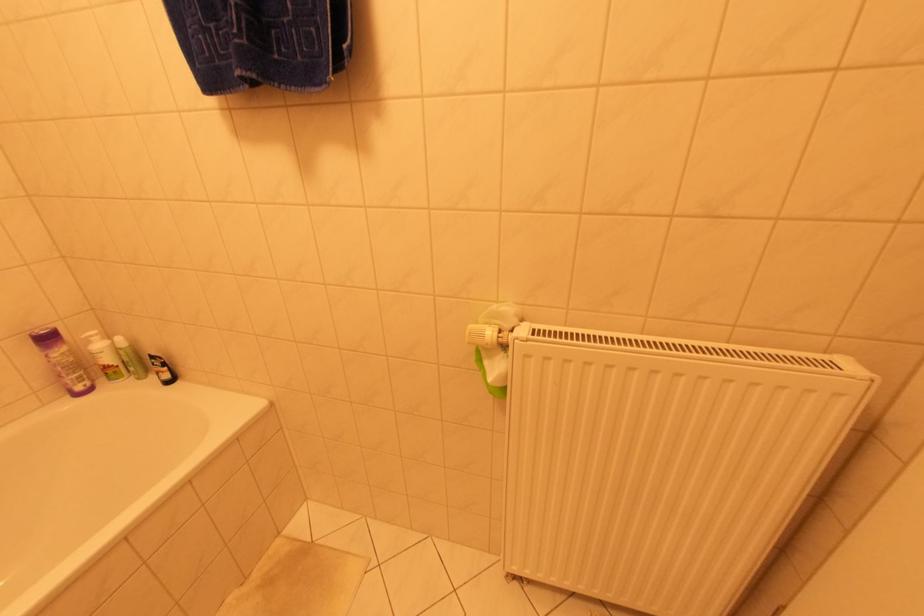
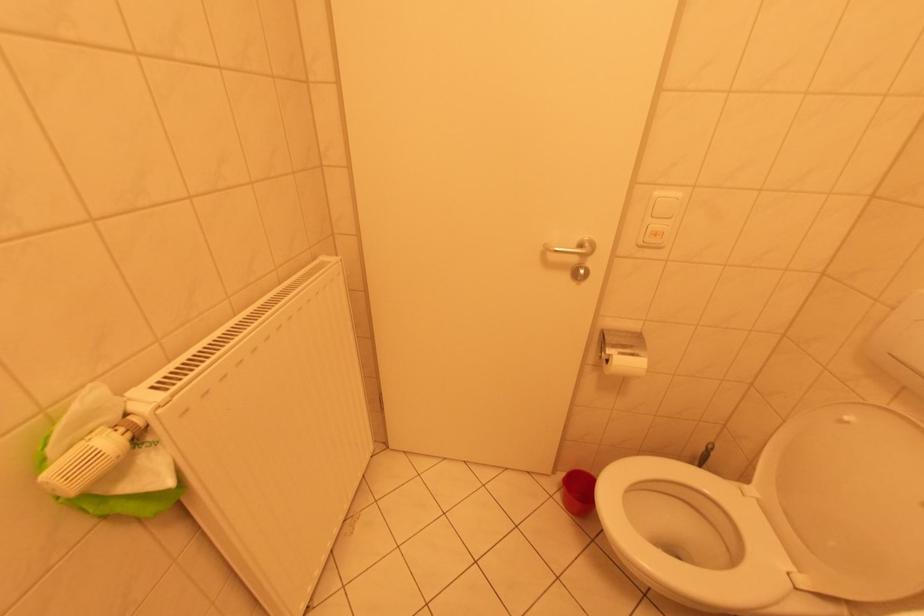
How did the camera likely rotate?

The rotation direction of the camera is right-down.